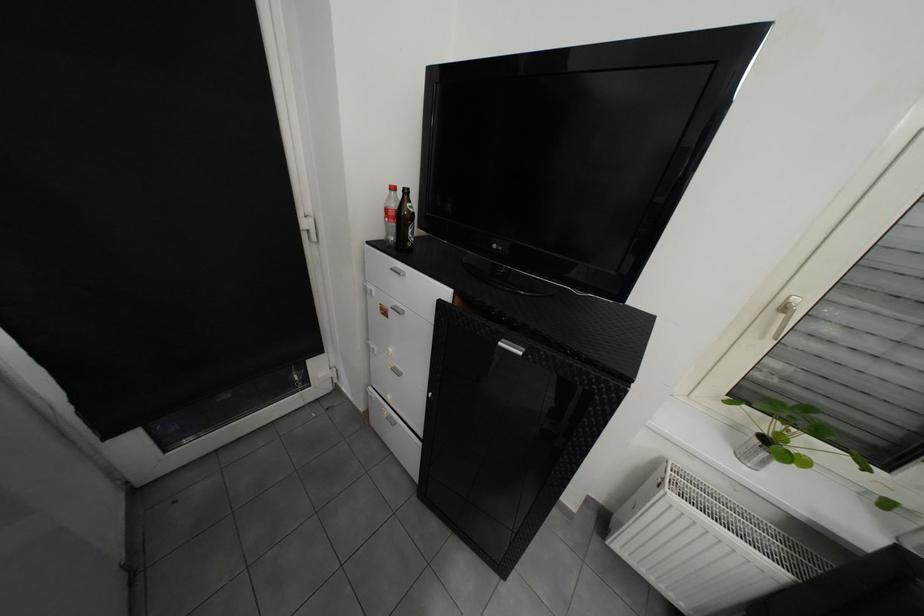
Locate an element on the screen. Image resolution: width=924 pixels, height=616 pixels. silver cabinet handle is located at coordinates (396, 309).